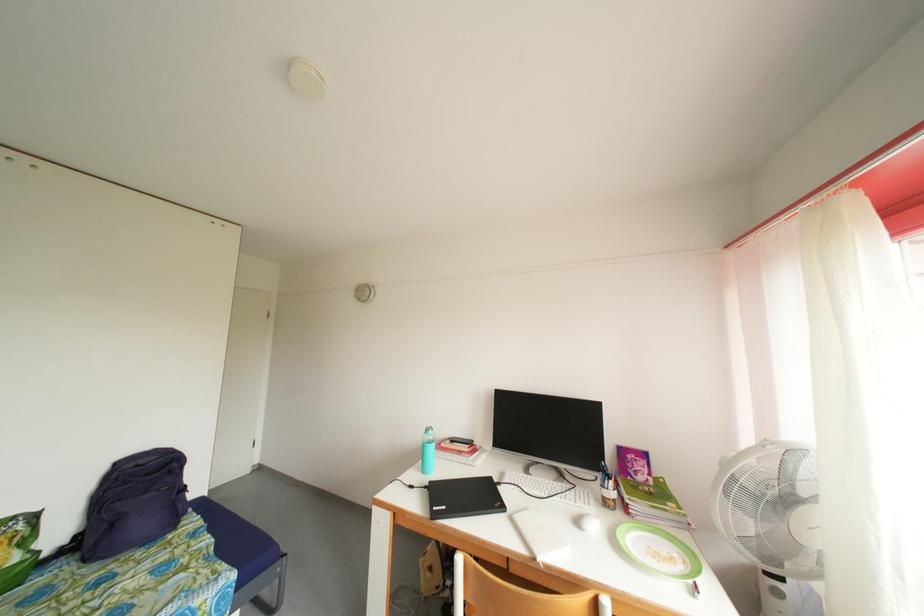
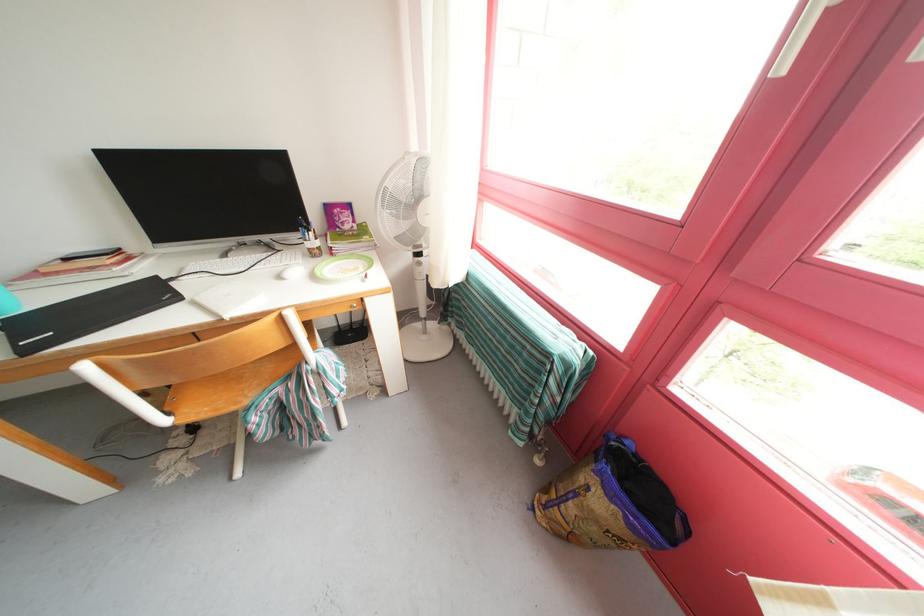
The point at (682, 544) is marked in the first image. Where is the corresponding point in the second image?

(369, 262)